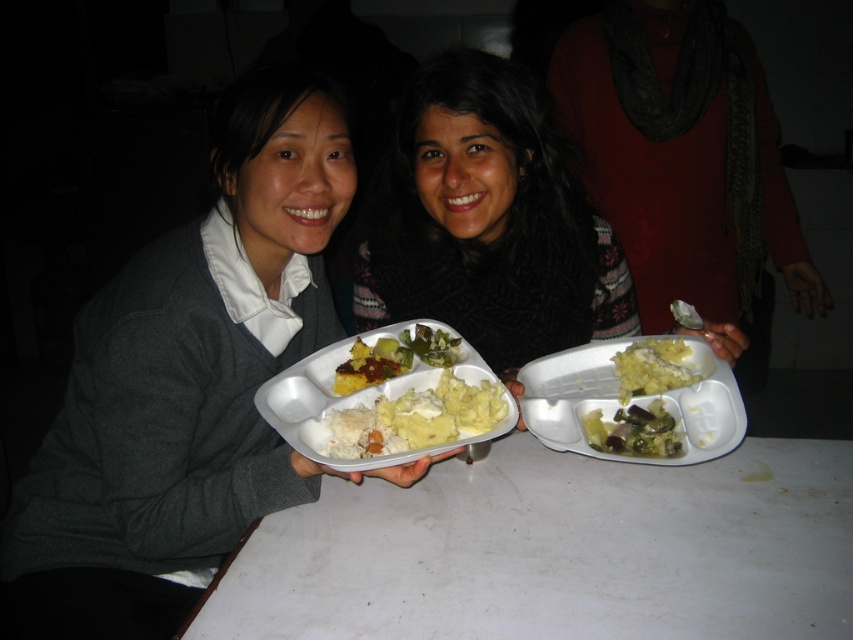
Between white creamy mashed potatoes at center and green matte mashed potatoes at center, which one has more height?

white creamy mashed potatoes at center is taller.

Does white creamy mashed potatoes at center appear on the right side of green matte mashed potatoes at center?

No, white creamy mashed potatoes at center is not to the right of green matte mashed potatoes at center.

Between point (473, 429) and point (613, 355), which one is positioned behind?

Point (613, 355)

The image size is (853, 640). I want to click on white creamy mashed potatoes at center, so click(416, 419).

Who is lower down, yellowish matte food at center or white creamy mashed potatoes at center?

white creamy mashed potatoes at center is lower down.

Does yellowish matte food at center lie in front of white creamy mashed potatoes at center?

No, yellowish matte food at center is behind white creamy mashed potatoes at center.

What do you see at coordinates (631, 400) in the screenshot? I see `yellowish matte food at center` at bounding box center [631, 400].

Where is `yellowish matte food at center`? yellowish matte food at center is located at coordinates (631, 400).

Which is in front, point (724, 381) or point (662, 403)?

Positioned in front is point (724, 381).

Where is `yellowish matte food at center`? yellowish matte food at center is located at coordinates (631, 400).